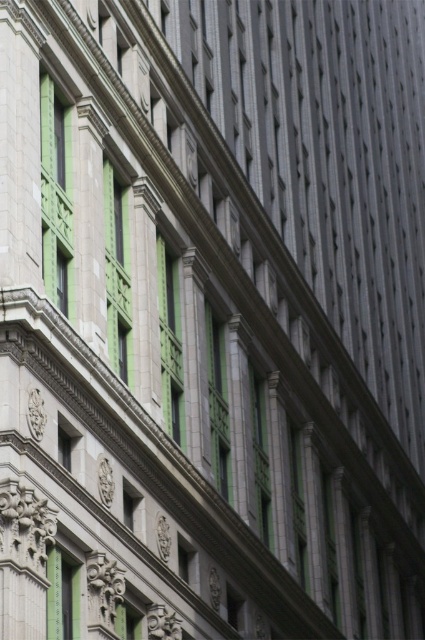
Question: Which point is farther to the camera?

Choices:
 (A) (42, 131)
 (B) (122, 324)

Answer: (B)

Question: Is green glass window at upper left to the left of green glass window at center from the viewer's perspective?

Choices:
 (A) no
 (B) yes

Answer: (B)

Question: In this image, where is green glass window at upper left located relative to green glass window at center?

Choices:
 (A) right
 (B) left

Answer: (B)

Question: Can you confirm if green glass window at upper left is positioned to the left of green glass window at center?

Choices:
 (A) no
 (B) yes

Answer: (B)